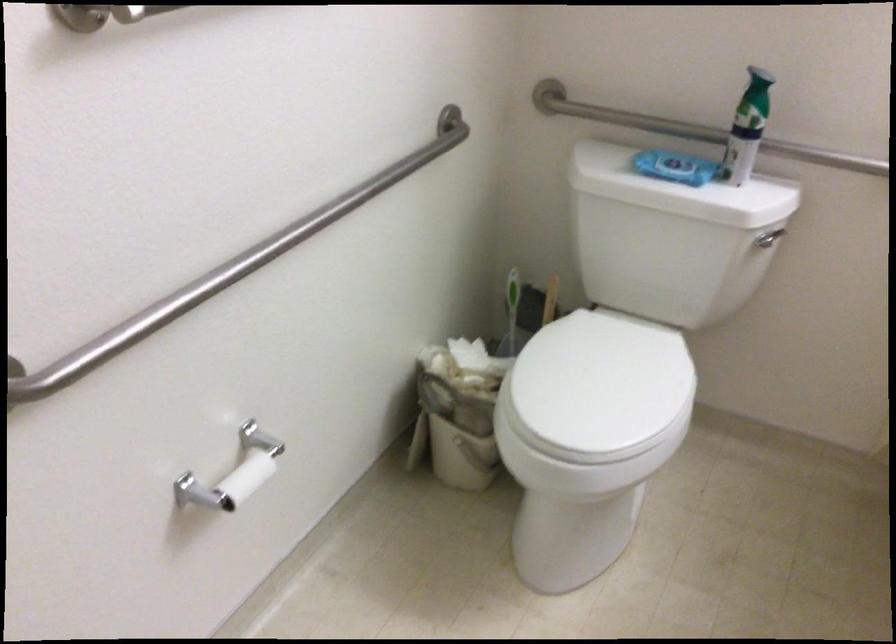
Locate an element on the screen. white toilet seat is located at coordinates (600, 384).